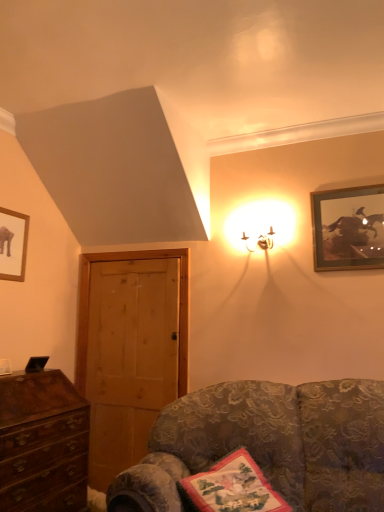
This screenshot has height=512, width=384. Describe the element at coordinates (260, 225) in the screenshot. I see `metallic gold sconce at upper right` at that location.

Image resolution: width=384 pixels, height=512 pixels. Describe the element at coordinates (232, 487) in the screenshot. I see `silk floral pillow at lower right` at that location.

You are a GUI agent. You are given a task and a screenshot of the screen. Output one action in this format:
    pyautogui.click(x=<x>, y=<y>)
    Task: Click on the velvet floral couch at lower right
    Image resolution: width=384 pixels, height=512 pixels.
    Given the screenshot: What is the action you would take?
    268,444

Is velvet floral couch at lower right bigger than gold-framed picture at upper right, the 1th picture frame from the right?

Indeed, velvet floral couch at lower right has a larger size compared to gold-framed picture at upper right, the 1th picture frame from the right.

From the image's perspective, does velvet floral couch at lower right appear lower than gold-framed picture at upper right, which is counted as the second picture frame, starting from the left?

Indeed, from the image's perspective, velvet floral couch at lower right is shown beneath gold-framed picture at upper right, which is counted as the second picture frame, starting from the left.

Is velvet floral couch at lower right in contact with gold-framed picture at upper right, the 1th picture frame from the right?

No, velvet floral couch at lower right is not next to gold-framed picture at upper right, the 1th picture frame from the right.

Locate an element on the screen. chest of drawers that appears on the right of matte black picture frame at upper left, the 1th picture frame from the left is located at coordinates (40, 437).

Which object is further away from the camera taking this photo, matte black picture frame at upper left, the 1th picture frame from the left, or mahogany wooden chest of drawers at lower left?

matte black picture frame at upper left, the 1th picture frame from the left.

Who is shorter, matte black picture frame at upper left, which is the second picture frame in right-to-left order, or mahogany wooden chest of drawers at lower left?

matte black picture frame at upper left, which is the second picture frame in right-to-left order.

Which is closer, (0,273) or (6,469)?

Point (0,273) appears to be farther away from the viewer than point (6,469).

Consider the image. From the image's perspective, is silk floral pillow at lower right above wooden door at left?

Actually, silk floral pillow at lower right appears below wooden door at left in the image.

Image resolution: width=384 pixels, height=512 pixels. Identify the location of pillow in front of the wooden door at left. (232, 487).

Consider the image. Which is in front, silk floral pillow at lower right or wooden door at left?

silk floral pillow at lower right.

Looking at this image, would you say silk floral pillow at lower right is inside or outside wooden door at left?

silk floral pillow at lower right cannot be found inside wooden door at left.

Locate an element on the screen. The height and width of the screenshot is (512, 384). chest of drawers below the wooden door at left (from the image's perspective) is located at coordinates (40, 437).

Considering the sizes of mahogany wooden chest of drawers at lower left and wooden door at left in the image, is mahogany wooden chest of drawers at lower left bigger or smaller than wooden door at left?

Considering their sizes, mahogany wooden chest of drawers at lower left takes up more space than wooden door at left.

Is wooden door at left inside mahogany wooden chest of drawers at lower left?

No.

Can you confirm if mahogany wooden chest of drawers at lower left is positioned to the right of wooden door at left?

Incorrect, mahogany wooden chest of drawers at lower left is not on the right side of wooden door at left.

From a real-world perspective, is mahogany wooden chest of drawers at lower left below metallic gold sconce at upper right?

Yes.

I want to click on light behind the mahogany wooden chest of drawers at lower left, so click(x=260, y=225).

Is the position of mahogany wooden chest of drawers at lower left less distant than that of metallic gold sconce at upper right?

Yes, mahogany wooden chest of drawers at lower left is in front of metallic gold sconce at upper right.

Is mahogany wooden chest of drawers at lower left located outside metallic gold sconce at upper right?

Yes, mahogany wooden chest of drawers at lower left is located beyond the bounds of metallic gold sconce at upper right.

Considering the positions of point (256, 219) and point (366, 406), is point (256, 219) closer or farther from the camera than point (366, 406)?

Clearly, point (256, 219) is more distant from the camera than point (366, 406).

In the image, there is a metallic gold sconce at upper right. Identify the location of studio couch below it (from the image's perspective). (268, 444).

Considering the relative positions of metallic gold sconce at upper right and velvet floral couch at lower right in the image provided, is metallic gold sconce at upper right to the right of velvet floral couch at lower right from the viewer's perspective?

Yes.

From the image's perspective, which is above, metallic gold sconce at upper right or velvet floral couch at lower right?

metallic gold sconce at upper right is shown above in the image.

Looking at this image, considering the sizes of velvet floral couch at lower right and metallic gold sconce at upper right in the image, is velvet floral couch at lower right wider or thinner than metallic gold sconce at upper right?

velvet floral couch at lower right is wider than metallic gold sconce at upper right.

From the image's perspective, is velvet floral couch at lower right located beneath metallic gold sconce at upper right?

Yes, from the image's perspective, velvet floral couch at lower right is beneath metallic gold sconce at upper right.

Which is behind, point (270, 400) or point (266, 239)?

Positioned behind is point (266, 239).

The image size is (384, 512). I want to click on studio couch on the left of gold-framed picture at upper right, which is counted as the second picture frame, starting from the left, so click(268, 444).

The height and width of the screenshot is (512, 384). What are the coordinates of `chest of drawers that appears on the right of matte black picture frame at upper left, which is the second picture frame in right-to-left order` in the screenshot? It's located at (40, 437).

Considering their positions, is velvet floral couch at lower right positioned further to wooden door at left than gold-framed picture at upper right, the 1th picture frame from the right?

Based on the image, gold-framed picture at upper right, the 1th picture frame from the right, appears to be further to wooden door at left.

Considering their positions, is metallic gold sconce at upper right positioned further to mahogany wooden chest of drawers at lower left than wooden door at left?

metallic gold sconce at upper right.

Looking at the image, which one is located further to wooden door at left, mahogany wooden chest of drawers at lower left or velvet floral couch at lower right?

The object further to wooden door at left is velvet floral couch at lower right.

When comparing their distances from matte black picture frame at upper left, the 1th picture frame from the left, does mahogany wooden chest of drawers at lower left or gold-framed picture at upper right, which is counted as the second picture frame, starting from the left, seem further?

gold-framed picture at upper right, which is counted as the second picture frame, starting from the left, lies further to matte black picture frame at upper left, the 1th picture frame from the left, than the other object.

When comparing their distances from wooden door at left, does metallic gold sconce at upper right or matte black picture frame at upper left, which is the second picture frame in right-to-left order, seem closer?

matte black picture frame at upper left, which is the second picture frame in right-to-left order, lies closer to wooden door at left than the other object.

Based on the photo, estimate the real-world distances between objects in this image. Which object is further from gold-framed picture at upper right, the 1th picture frame from the right, matte black picture frame at upper left, which is the second picture frame in right-to-left order, or velvet floral couch at lower right?

matte black picture frame at upper left, which is the second picture frame in right-to-left order.

From the image, which object appears to be farther from velvet floral couch at lower right, metallic gold sconce at upper right or gold-framed picture at upper right, the 1th picture frame from the right?

The object further to velvet floral couch at lower right is metallic gold sconce at upper right.

Looking at the image, which one is located further to silk floral pillow at lower right, mahogany wooden chest of drawers at lower left or wooden door at left?

Among the two, wooden door at left is located further to silk floral pillow at lower right.

I want to click on pillow between velvet floral couch at lower right and wooden door at left in the front-back direction, so click(232, 487).

Locate an element on the screen. This screenshot has width=384, height=512. door between matte black picture frame at upper left, the 1th picture frame from the left, and gold-framed picture at upper right, which is counted as the second picture frame, starting from the left, from left to right is located at coordinates (129, 350).

The image size is (384, 512). I want to click on chest of drawers between matte black picture frame at upper left, which is the second picture frame in right-to-left order, and silk floral pillow at lower right, in the horizontal direction, so pyautogui.click(x=40, y=437).

I want to click on door between matte black picture frame at upper left, which is the second picture frame in right-to-left order, and metallic gold sconce at upper right, in the horizontal direction, so click(x=129, y=350).